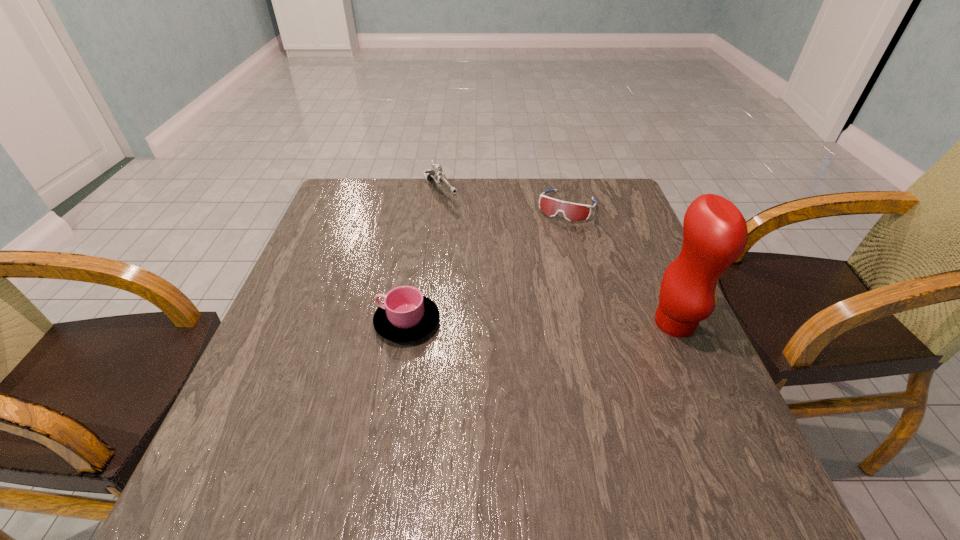
Where is `vacant space that satisfies the following two spatial constraints: 1. on the front side of the goggles; 2. on the left side of the second tallest object`? Image resolution: width=960 pixels, height=540 pixels. vacant space that satisfies the following two spatial constraints: 1. on the front side of the goggles; 2. on the left side of the second tallest object is located at coordinates (439, 207).

Locate an element on the screen. This screenshot has height=540, width=960. free space that satisfies the following two spatial constraints: 1. on the front side of the goggles; 2. on the left side of the gun is located at coordinates (439, 207).